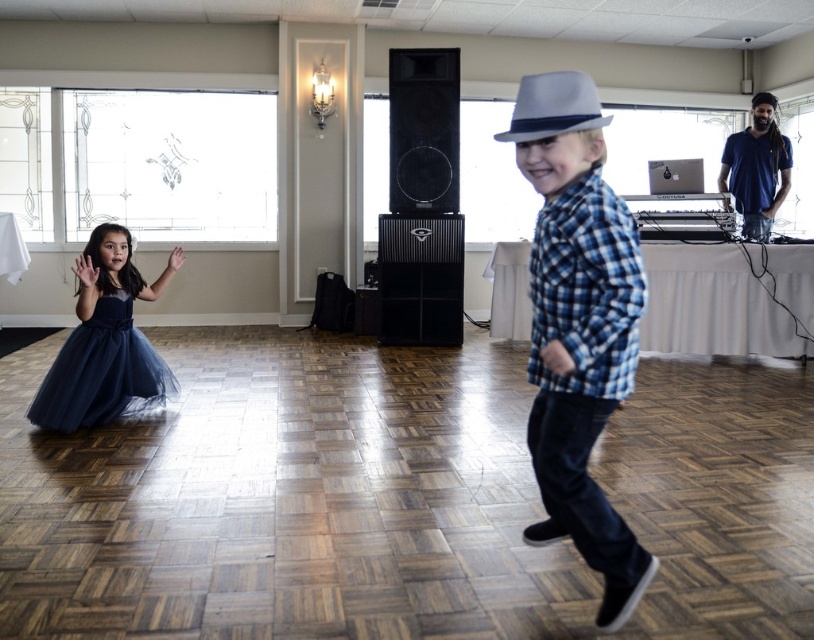
Is the position of navy tulle dress at lower left more distant than that of gray felt fedora at upper center?

Yes, it is behind gray felt fedora at upper center.

Find the location of a particular element. This screenshot has width=814, height=640. navy tulle dress at lower left is located at coordinates (101, 371).

Between point (82, 380) and point (537, 116), which one is positioned in front?

Point (537, 116)

The image size is (814, 640). I want to click on navy tulle dress at lower left, so click(101, 371).

Can you confirm if blue plaid shirt at center is wider than gray felt fedora at upper center?

Yes, blue plaid shirt at center is wider than gray felt fedora at upper center.

Locate an element on the screen. This screenshot has width=814, height=640. blue plaid shirt at center is located at coordinates (578, 324).

Between blue plaid shirt at center and navy tulle dress at lower left, which one appears on the left side from the viewer's perspective?

navy tulle dress at lower left is more to the left.

Locate an element on the screen. This screenshot has width=814, height=640. blue plaid shirt at center is located at coordinates (578, 324).